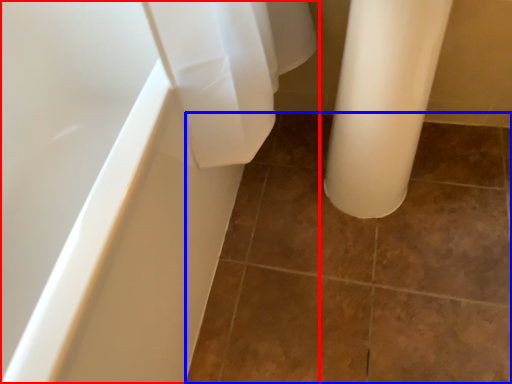
Question: Which of the following is the farthest to the observer, bathtub (highlighted by a red box) or ceramic tile (highlighted by a blue box)?

Choices:
 (A) bathtub
 (B) ceramic tile

Answer: (B)